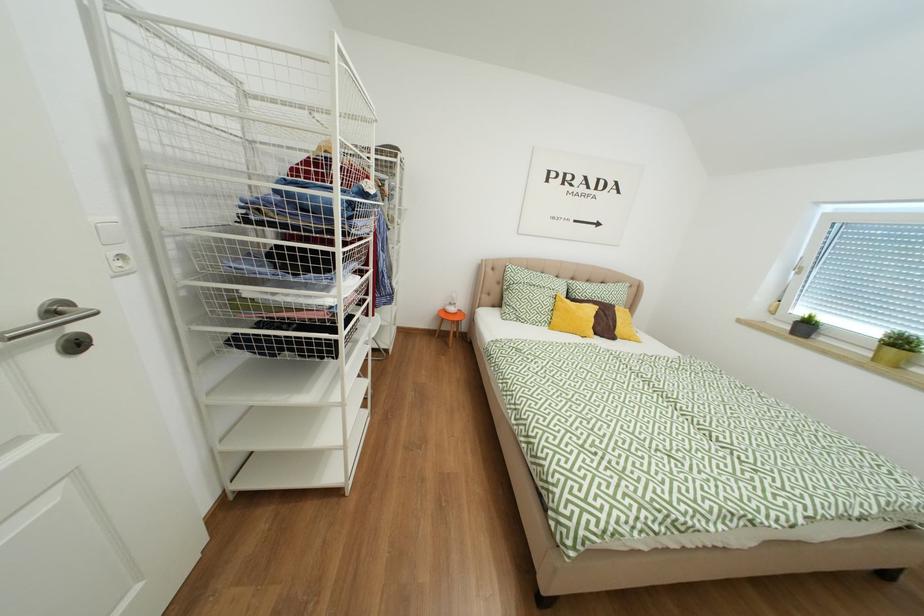
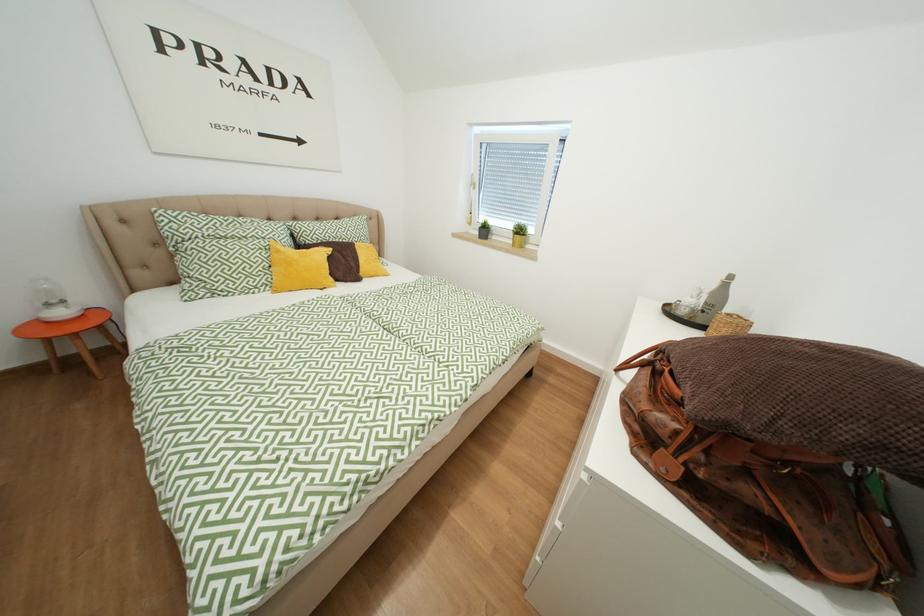
How did the camera likely rotate?

The camera rotated toward right-down.